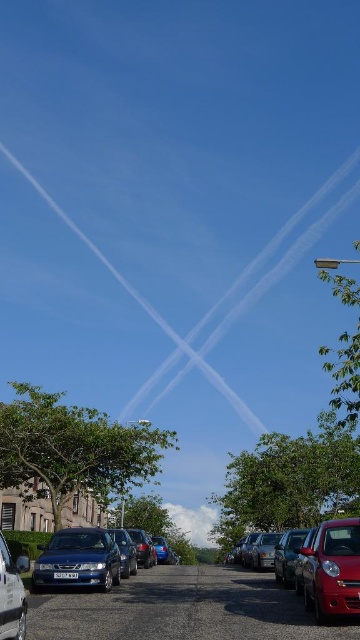
Question: Can you confirm if metallic silver car at center is positioned to the left of metallic silver sedan at center?

Choices:
 (A) no
 (B) yes

Answer: (A)

Question: Is shiny red car at lower right in front of metallic silver car at center?

Choices:
 (A) yes
 (B) no

Answer: (A)

Question: Is metallic blue sedan at center to the right of metallic silver sedan at center from the viewer's perspective?

Choices:
 (A) no
 (B) yes

Answer: (A)

Question: Which is farther from the shiny red car at lower right?

Choices:
 (A) matte red car at lower right
 (B) metallic silver sedan at center
 (C) metallic blue sedan at lower left
 (D) metallic silver car at center

Answer: (B)

Question: Considering the real-world distances, which object is farthest from the metallic gray cars at lower left?

Choices:
 (A) metallic blue sedan at center
 (B) metallic silver sedan at center
 (C) metallic silver car at lower left
 (D) shiny red car at lower right

Answer: (C)

Question: Which object appears closest to the camera in this image?

Choices:
 (A) metallic blue sedan at center
 (B) matte red car at lower right

Answer: (B)